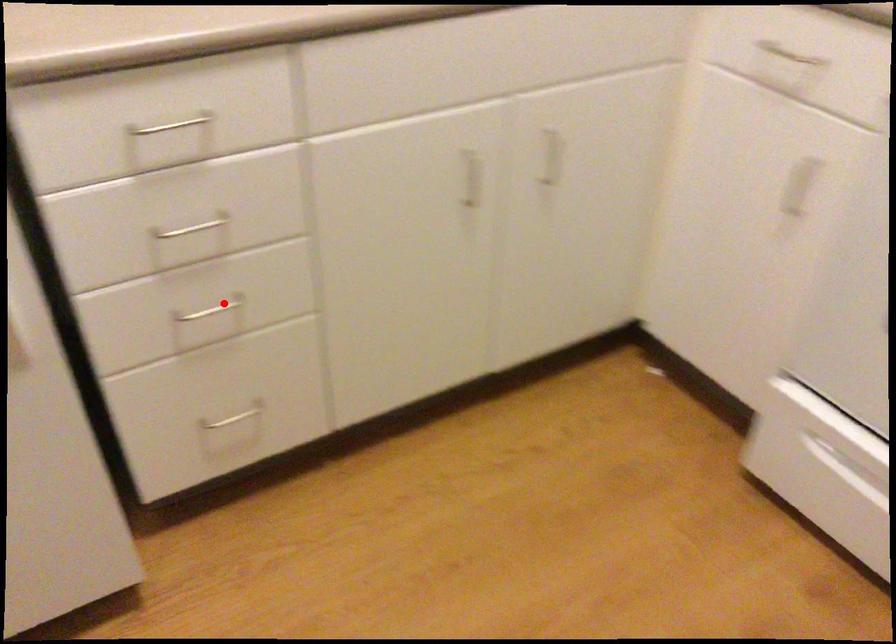
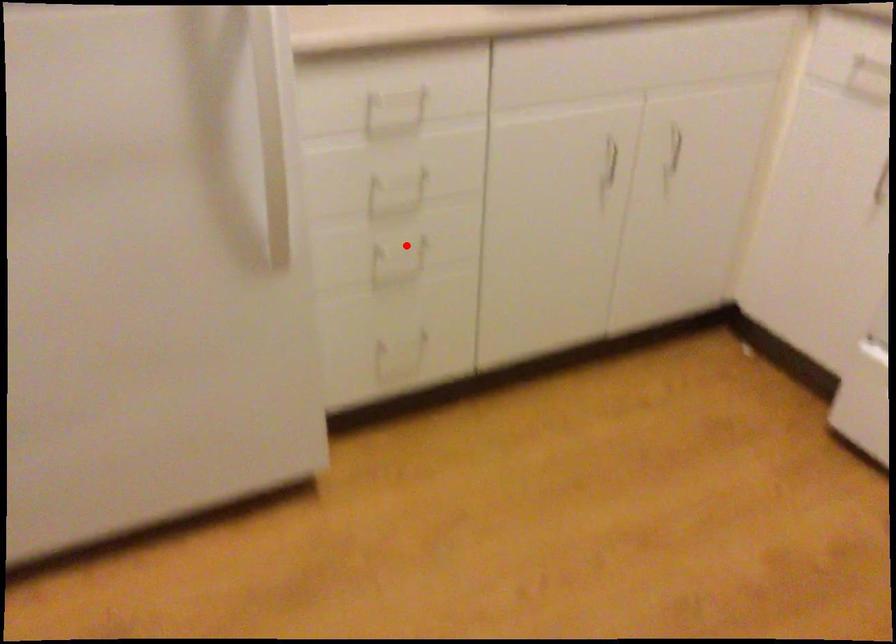
I am providing you with two images of the same scene from different viewpoints. A red point is marked on the first image and another point is marked on the second image. Are the points marked in image1 and image2 representing the same 3D position?

Yes